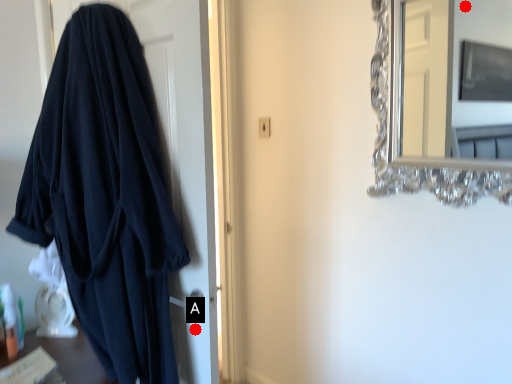
Question: Two points are circled on the image, labeled by A and B beside each circle. Which point is farther to the camera?

Choices:
 (A) A is further
 (B) B is further

Answer: (B)